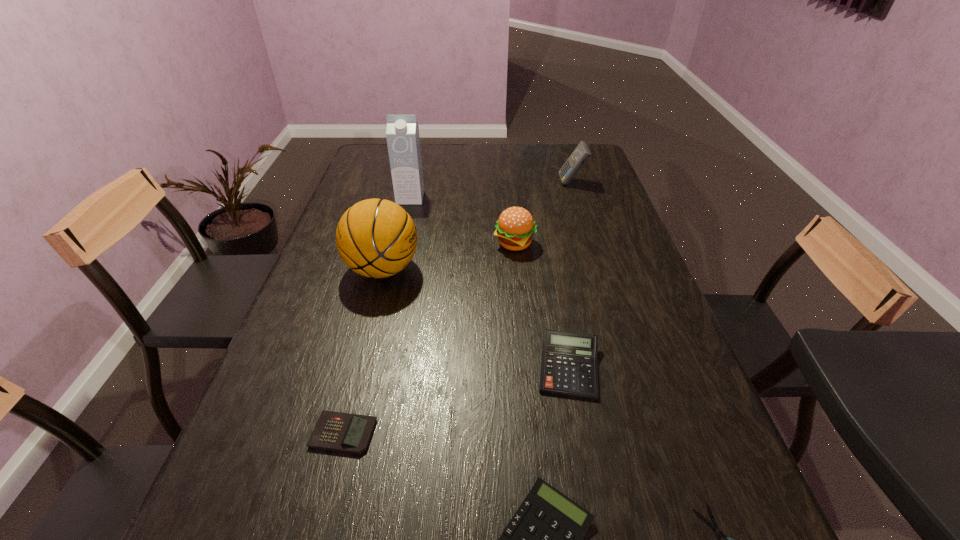
The height and width of the screenshot is (540, 960). Identify the location of object present at the right edge. (580, 155).

Identify the location of free point at the far edge. (442, 171).

Identify the location of blank space at the left edge of the desktop. (357, 180).

This screenshot has height=540, width=960. I want to click on free space at the right edge, so click(x=639, y=366).

Find the location of a particular element. The height and width of the screenshot is (540, 960). vacant space that is in between the leftmost calculator and the rightmost calculator is located at coordinates (458, 308).

Locate an element on the screen. empty location between the carton and the fourth tallest object is located at coordinates (463, 221).

The height and width of the screenshot is (540, 960). Identify the location of empty location between the second farthest object and the second nearest calculator. (377, 315).

The width and height of the screenshot is (960, 540). What are the coordinates of `vacant point located between the tallest calculator and the third nearest object` in the screenshot? It's located at (458, 308).

Locate an element on the screen. Image resolution: width=960 pixels, height=540 pixels. free space between the fifth shortest object and the second farthest object is located at coordinates (463, 221).

This screenshot has width=960, height=540. I want to click on free point between the sixth farthest object and the fourth nearest object, so click(x=456, y=400).